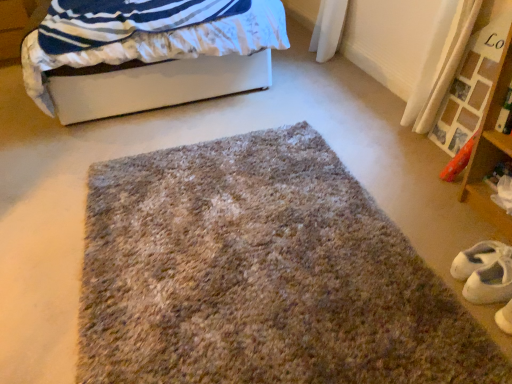
Identify the location of free area behind white suede shoe at lower right. (444, 234).